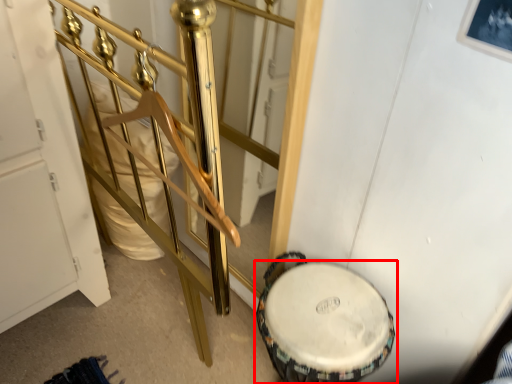
Question: From the image's perspective, considering the relative positions of drum (annotated by the red box) and rail in the image provided, where is drum (annotated by the red box) located with respect to the staircase?

Choices:
 (A) above
 (B) below

Answer: (B)